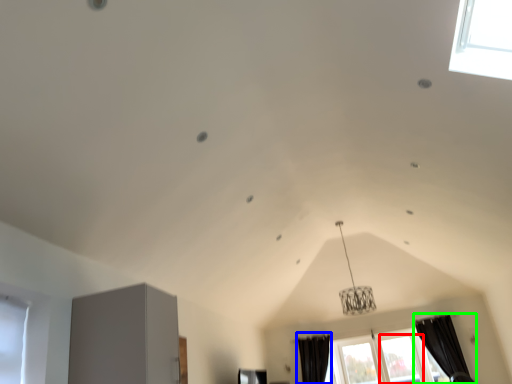
Question: Which object is the farthest from window (highlighted by a red box)? Choose among these: curtain (highlighted by a blue box) or curtain (highlighted by a green box).

Choices:
 (A) curtain
 (B) curtain

Answer: (A)